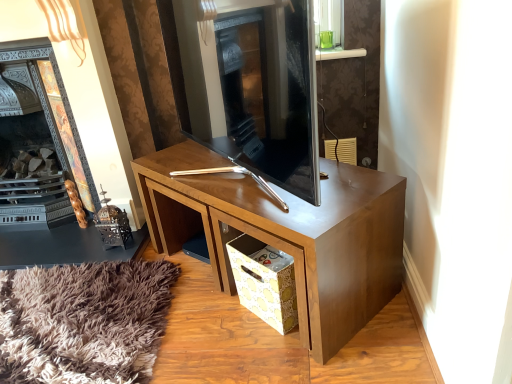
Find the location of a particular element. Image resolution: width=512 pixels, height=384 pixels. vacant space situated on the left part of yellow paper bag at lower center is located at coordinates (210, 321).